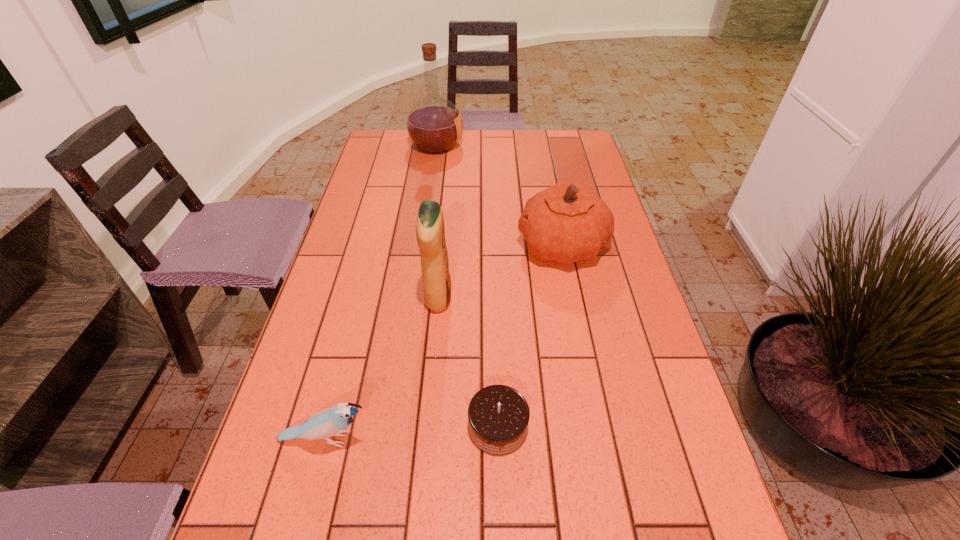
Find the location of a particular element. The height and width of the screenshot is (540, 960). vacant region located on the label of the third farthest object is located at coordinates (488, 299).

At what (x,y) coordinates should I click in order to perform the action: click on free space located 0.230m on the front-facing side of the third tallest object. Please return your answer as a coordinate pair (x, y). Image resolution: width=960 pixels, height=540 pixels. Looking at the image, I should click on (436, 245).

Identify the location of vacant region located 0.070m on the front-facing side of the third tallest object. This screenshot has width=960, height=540. (492, 245).

Find the location of `free location located 0.090m on the front-facing side of the third tallest object`. free location located 0.090m on the front-facing side of the third tallest object is located at coordinates (485, 245).

Where is `vacant area situated at the face of the bird`? vacant area situated at the face of the bird is located at coordinates (436, 440).

Locate an element on the screen. The height and width of the screenshot is (540, 960). vacant region located on the front of the shortest object is located at coordinates (500, 495).

Identify the location of object that is positioned at the far edge. The width and height of the screenshot is (960, 540). (434, 124).

Image resolution: width=960 pixels, height=540 pixels. I want to click on liquor located at the left edge, so click(x=434, y=124).

Identify the location of bird that is at the left edge. (330, 422).

At what (x,y) coordinates should I click in order to perform the action: click on object at the right edge. Please return your answer as a coordinate pair (x, y). The height and width of the screenshot is (540, 960). Looking at the image, I should click on (566, 223).